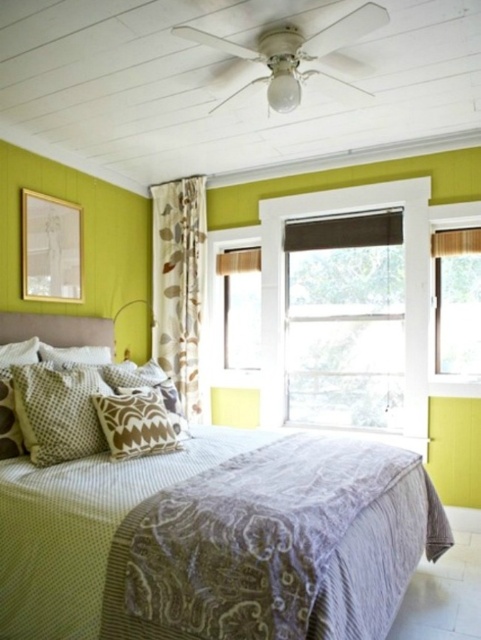
Question: Based on their relative distances, which object is nearer to the matte glass window at center?

Choices:
 (A) matte brown curtain at right
 (B) brown textured pillow at center

Answer: (A)

Question: Does textured beige bed at center appear on the left side of patterned fabric pillow at left?

Choices:
 (A) yes
 (B) no

Answer: (B)

Question: Which of these objects is positioned farthest from the matte glass window at center?

Choices:
 (A) matte gray roller shade at center
 (B) patterned fabric pillow at center

Answer: (B)

Question: Which point is closer to the camera taking this photo?

Choices:
 (A) (26, 332)
 (B) (83, 355)

Answer: (A)

Question: Does textured beige bed at center appear under patterned fabric pillow at left?

Choices:
 (A) yes
 (B) no

Answer: (A)

Question: Does textured beige bed at center appear under matte glass window at center?

Choices:
 (A) yes
 (B) no

Answer: (A)